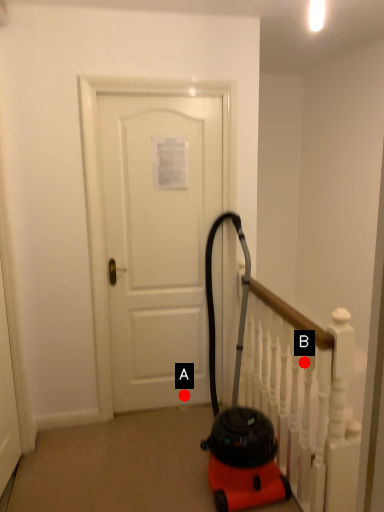
Question: Two points are circled on the image, labeled by A and B beside each circle. Which of the following is the farthest from the observer?

Choices:
 (A) A is further
 (B) B is further

Answer: (A)